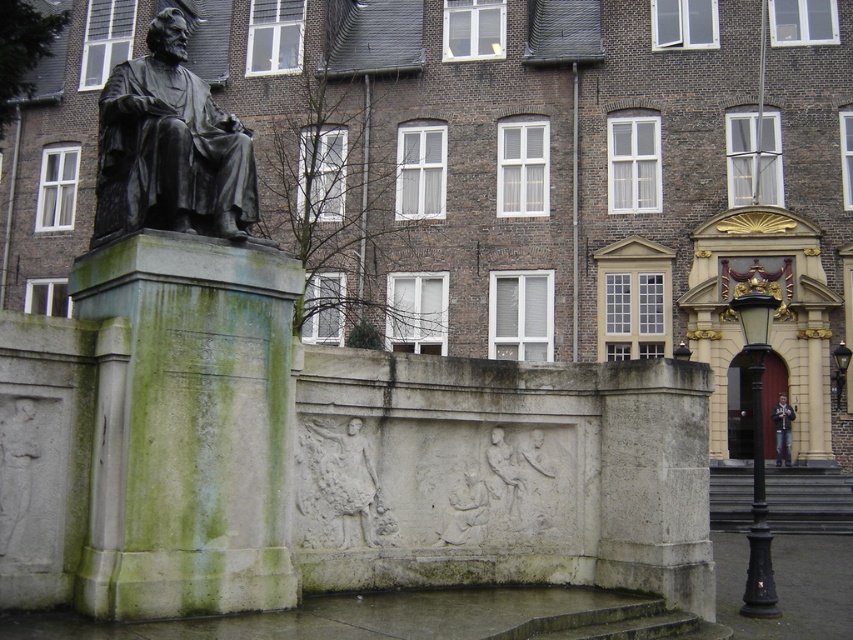
Question: Which object is positioned closest to the green mossy stone at left?

Choices:
 (A) white stone relief at center
 (B) bronze statue at left

Answer: (A)

Question: Can you confirm if green mossy stone at left is positioned to the right of white stone relief at center?

Choices:
 (A) no
 (B) yes

Answer: (A)

Question: Considering the relative positions of green mossy stone at left and bronze statue at left in the image provided, where is green mossy stone at left located with respect to bronze statue at left?

Choices:
 (A) above
 (B) below

Answer: (B)

Question: Which is farther from the green mossy stone at left?

Choices:
 (A) bronze statue at left
 (B) white stone relief at center

Answer: (A)

Question: Can you confirm if bronze statue at left is thinner than white stone relief at center?

Choices:
 (A) yes
 (B) no

Answer: (B)

Question: Which point is closer to the camera taking this photo?

Choices:
 (A) (370, 545)
 (B) (242, 182)
 (C) (80, 570)

Answer: (C)